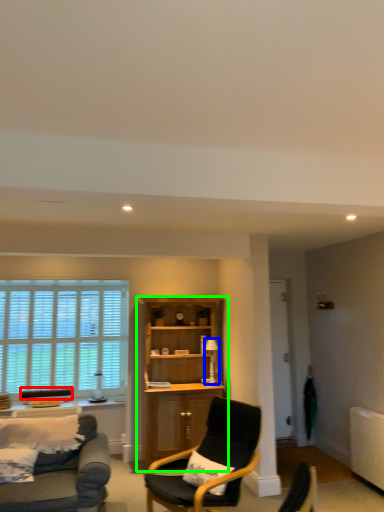
Question: Which is farther away from armchair (highlighted by a red box)? lamp (highlighted by a blue box) or cabinetry (highlighted by a green box)?

Choices:
 (A) lamp
 (B) cabinetry

Answer: (A)